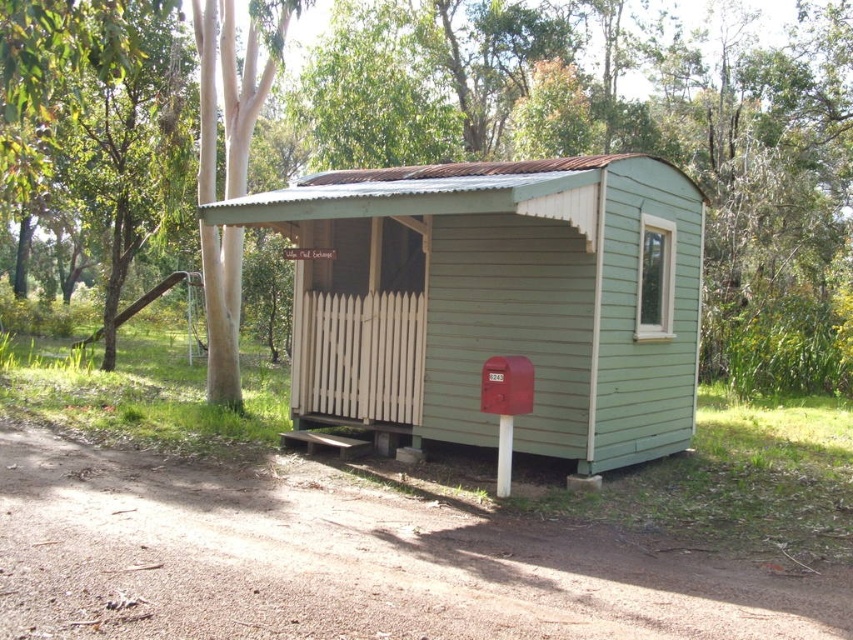
Does green wood tree at center have a larger size compared to green wood cabin at center?

Yes.

At what (x,y) coordinates should I click in order to perform the action: click on green wood tree at center. Please return your answer as a coordinate pair (x, y). Looking at the image, I should click on (630, 140).

Image resolution: width=853 pixels, height=640 pixels. I want to click on green wood tree at center, so click(x=630, y=140).

Can you confirm if green wood tree at center is wider than metallic red mailbox at center?

Indeed, green wood tree at center has a greater width compared to metallic red mailbox at center.

Who is taller, green wood tree at center or metallic red mailbox at center?

Standing taller between the two is green wood tree at center.

Does point (431, 32) come closer to viewer compared to point (500, 476)?

No, (431, 32) is further to viewer.

Where is `green wood tree at center`? green wood tree at center is located at coordinates (630, 140).

Is green wood cabin at center wider than metallic red mailbox at center?

Indeed, green wood cabin at center has a greater width compared to metallic red mailbox at center.

Which is above, green wood cabin at center or metallic red mailbox at center?

green wood cabin at center is above.

What do you see at coordinates (495, 300) in the screenshot? I see `green wood cabin at center` at bounding box center [495, 300].

You are a GUI agent. You are given a task and a screenshot of the screen. Output one action in this format:
    pyautogui.click(x=<x>, y=<y>)
    Task: Click on the green wood cabin at center
    
    Given the screenshot: What is the action you would take?
    pyautogui.click(x=495, y=300)